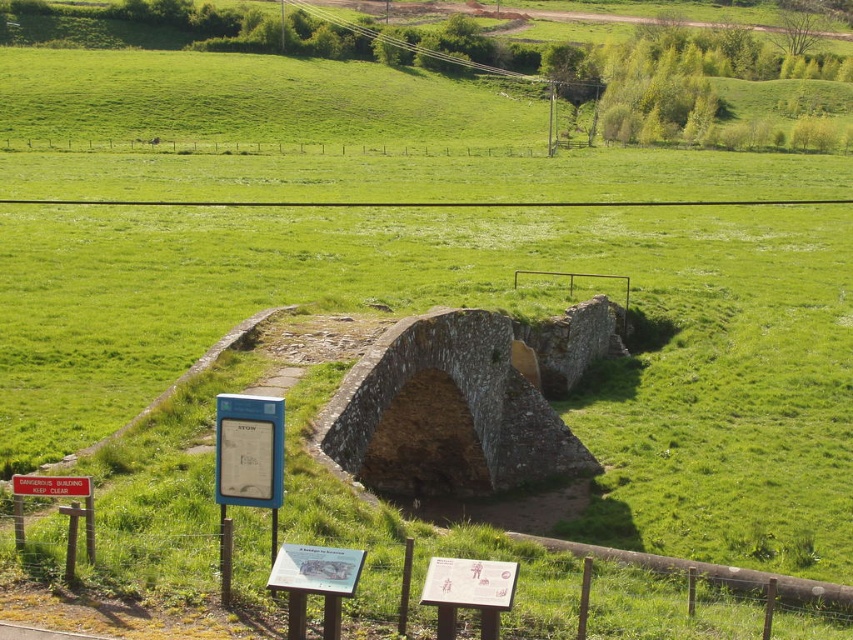
Can you confirm if stone arch bridge at center is shorter than red plastic sign at lower left?

No, stone arch bridge at center is not shorter than red plastic sign at lower left.

Measure the distance between point (546, 419) and camera.

56.72 meters

You are a GUI agent. You are given a task and a screenshot of the screen. Output one action in this format:
    pyautogui.click(x=<x>, y=<y>)
    Task: Click on the stone arch bridge at center
    The height and width of the screenshot is (640, 853).
    Given the screenshot: What is the action you would take?
    pyautogui.click(x=463, y=403)